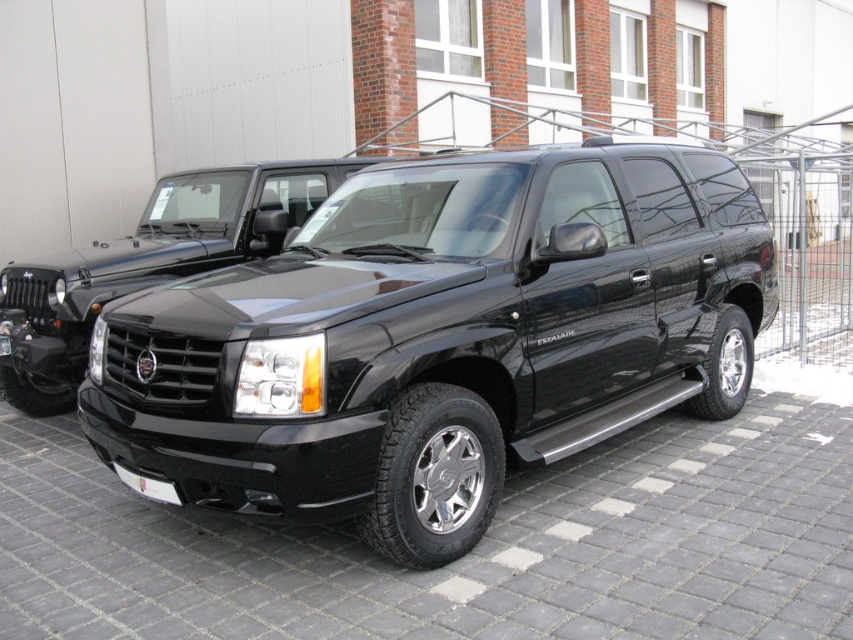
You are a delivery person trying to park your van between the glossy black suv at center and the white plastic license plate at center. Can you park your van there?

The glossy black suv at center is in front of the white plastic license plate at center, so there is no space between them for the van to park.

You are a photographer standing in front of the glossy black suv at center and the white plastic license plate at lower center. You want to take a picture of both objects. Which object should you focus on first to ensure both are in sharp focus?

You should focus on the glossy black suv at center first because it is closer to the viewer than the white plastic license plate at lower center. By focusing on the closer object, the background object will also be in focus due to the depth of field.